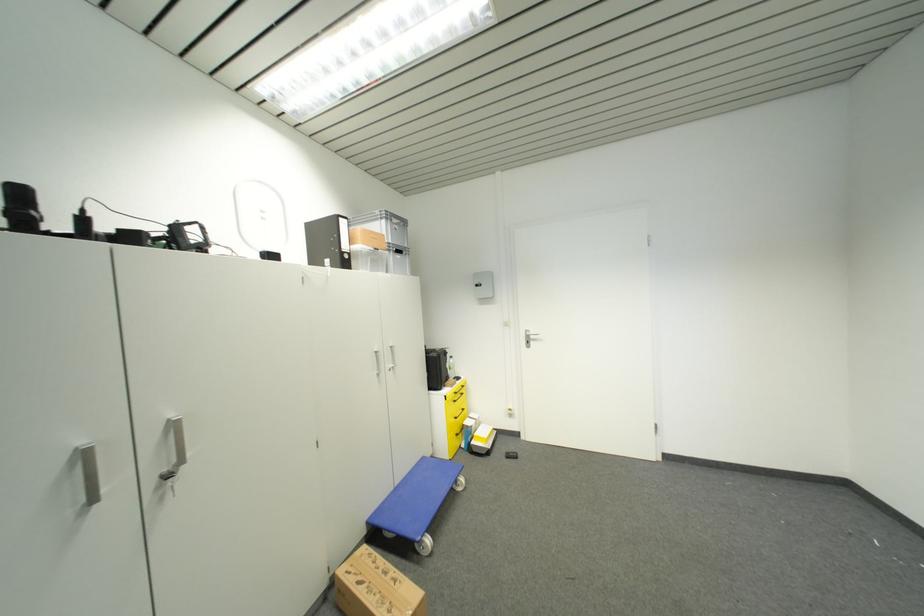
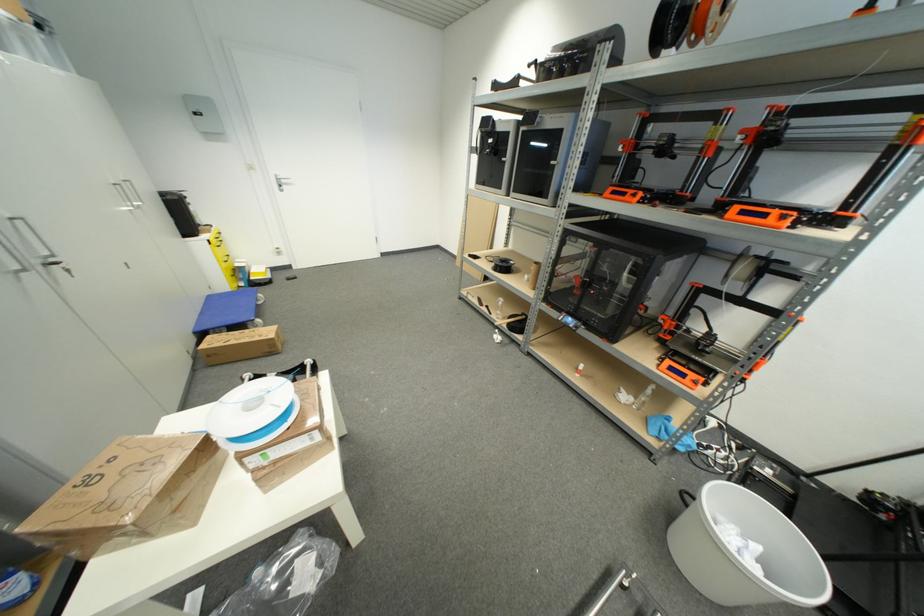
The point at (528, 345) is marked in the first image. Where is the corresponding point in the second image?

(281, 188)